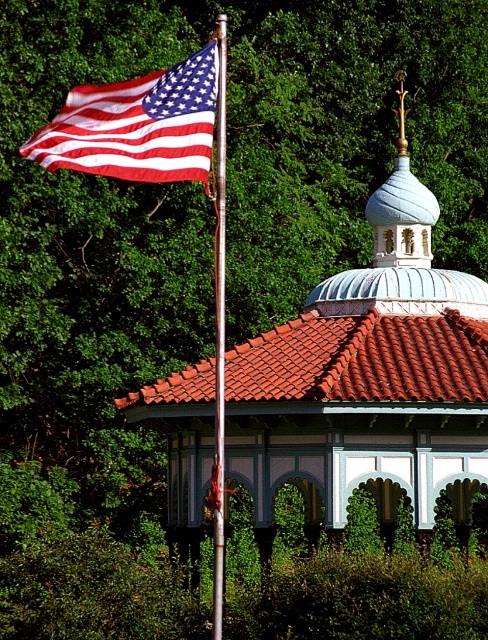
Question: Is red clay tiles at center behind matte fabric flag at upper left?

Choices:
 (A) no
 (B) yes

Answer: (B)

Question: Based on their relative distances, which object is nearer to the white textured dome at upper center?

Choices:
 (A) red clay tiles at center
 (B) matte fabric flag at upper left

Answer: (A)

Question: Which is farther from the white painted wood gazebo at center?

Choices:
 (A) white textured dome at upper center
 (B) matte fabric flag at upper left

Answer: (B)

Question: Is the position of white painted wood gazebo at center less distant than that of matte fabric flag at upper left?

Choices:
 (A) yes
 (B) no

Answer: (B)

Question: Is white painted wood gazebo at center positioned behind matte fabric flag at upper left?

Choices:
 (A) no
 (B) yes

Answer: (B)

Question: Based on their relative distances, which object is farther from the matte fabric flag at upper left?

Choices:
 (A) white textured dome at upper center
 (B) red clay tiles at center

Answer: (A)